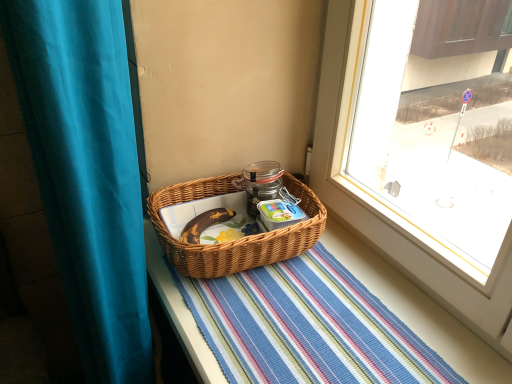
Question: Does woven brown picnic basket at center have a greater width compared to striped woven mat at center?

Choices:
 (A) yes
 (B) no

Answer: (B)

Question: Does woven brown picnic basket at center have a greater height compared to striped woven mat at center?

Choices:
 (A) no
 (B) yes

Answer: (B)

Question: Is striped woven mat at center completely or partially inside woven brown picnic basket at center?

Choices:
 (A) yes
 (B) no

Answer: (B)

Question: From the image's perspective, is woven brown picnic basket at center located beneath striped woven mat at center?

Choices:
 (A) yes
 (B) no

Answer: (B)

Question: Considering the relative positions of woven brown picnic basket at center and striped woven mat at center in the image provided, is woven brown picnic basket at center to the right of striped woven mat at center from the viewer's perspective?

Choices:
 (A) no
 (B) yes

Answer: (A)

Question: Considering the relative sizes of woven brown picnic basket at center and striped woven mat at center in the image provided, is woven brown picnic basket at center bigger than striped woven mat at center?

Choices:
 (A) no
 (B) yes

Answer: (A)

Question: Is teal fabric curtain at left bigger than striped woven mat at center?

Choices:
 (A) yes
 (B) no

Answer: (A)

Question: Is teal fabric curtain at left further to the viewer compared to striped woven mat at center?

Choices:
 (A) yes
 (B) no

Answer: (B)

Question: Is the depth of teal fabric curtain at left less than that of striped woven mat at center?

Choices:
 (A) yes
 (B) no

Answer: (A)

Question: Does teal fabric curtain at left have a greater width compared to striped woven mat at center?

Choices:
 (A) yes
 (B) no

Answer: (B)

Question: Considering the relative sizes of teal fabric curtain at left and striped woven mat at center in the image provided, is teal fabric curtain at left shorter than striped woven mat at center?

Choices:
 (A) yes
 (B) no

Answer: (B)

Question: Does teal fabric curtain at left have a lesser width compared to striped woven mat at center?

Choices:
 (A) no
 (B) yes

Answer: (B)

Question: Is teal fabric curtain at left surrounded by woven brown picnic basket at center?

Choices:
 (A) yes
 (B) no

Answer: (B)